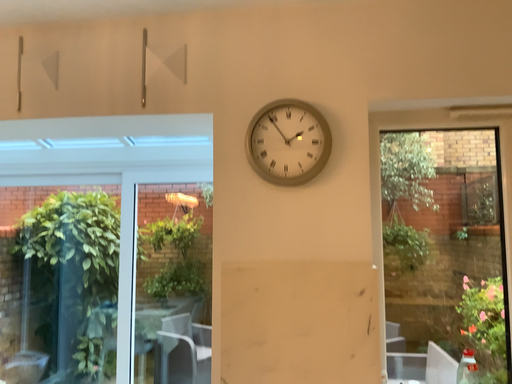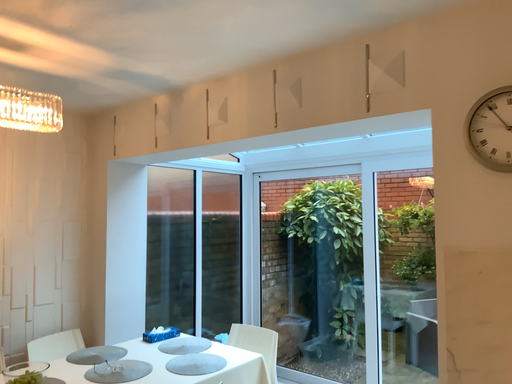
Question: Which way did the camera rotate in the video?

Choices:
 (A) rotated left
 (B) rotated right

Answer: (A)